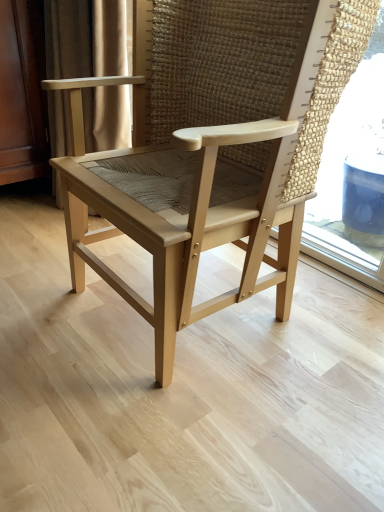
Image resolution: width=384 pixels, height=512 pixels. Identify the location of vacant region in front of natural wood chair at center. [x=178, y=426].